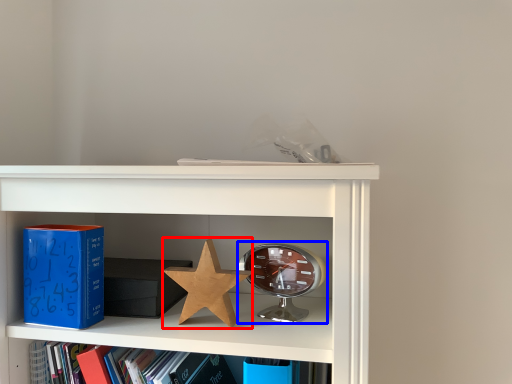
Question: Which object is further to the camera taking this photo, star (highlighted by a red box) or alarm clock (highlighted by a blue box)?

Choices:
 (A) star
 (B) alarm clock

Answer: (B)